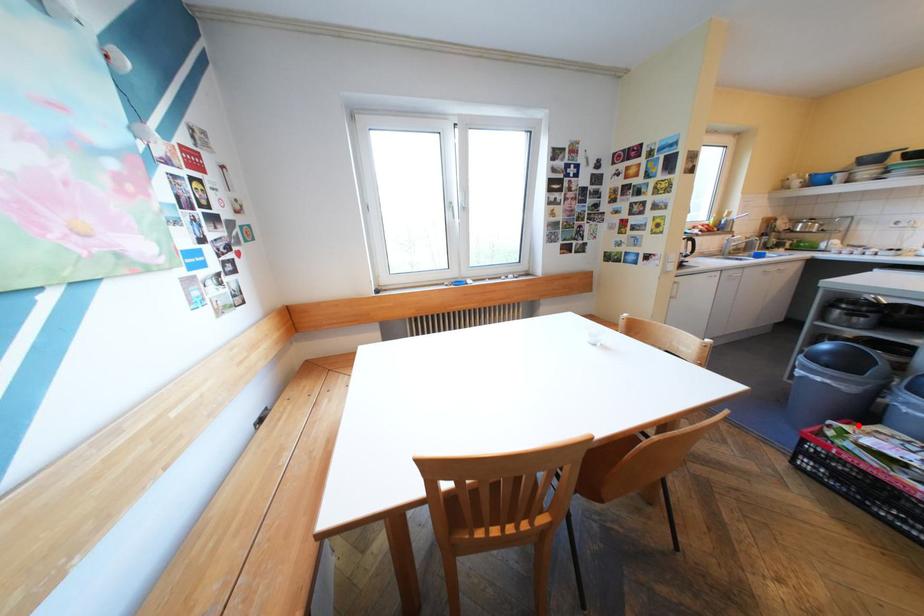
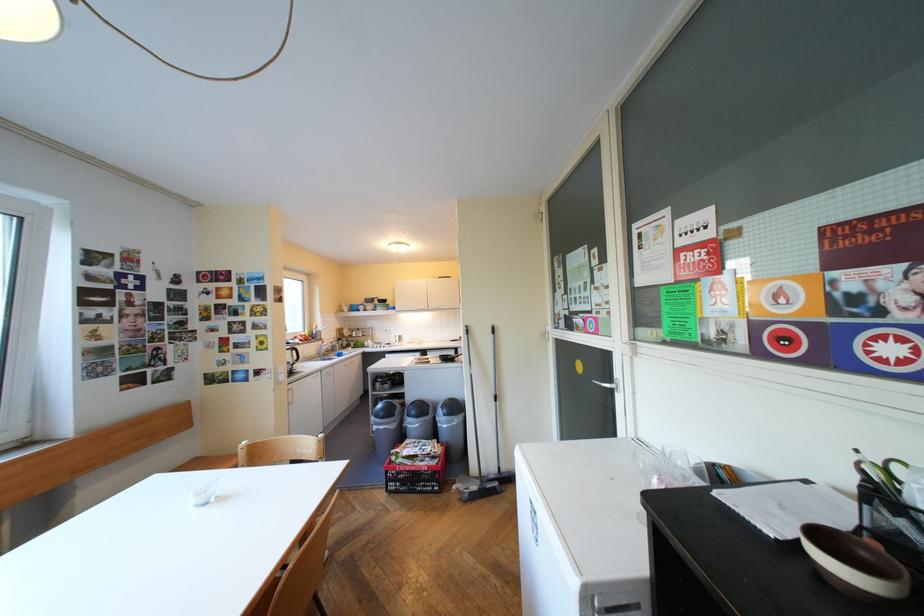
Question: I am providing you with two images of the same scene from different viewpoints. A red point is shown in image1. For the corresponding object point in image2, is it positioned nearer or farther from the camera?

Choices:
 (A) Nearer
 (B) Farther

Answer: (B)